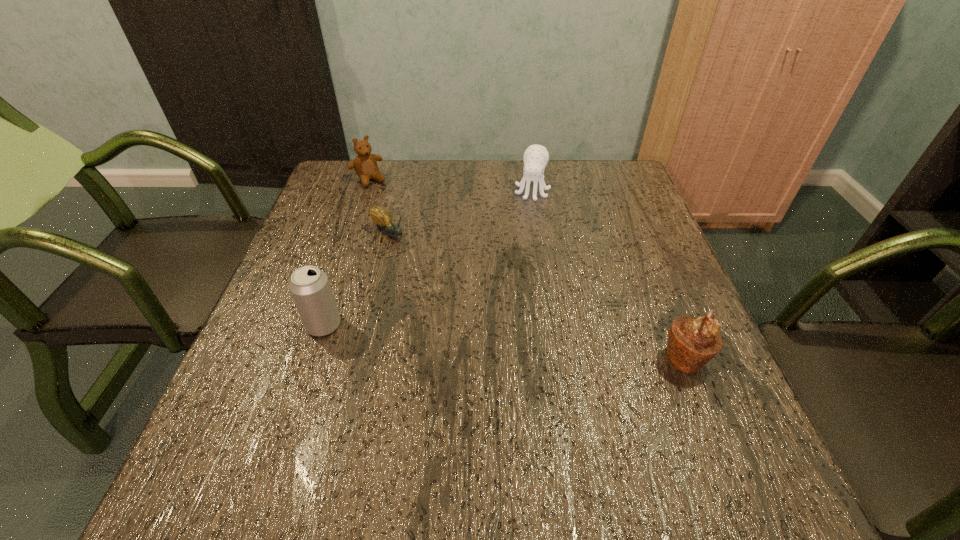
You are a GUI agent. You are given a task and a screenshot of the screen. Output one action in this format:
    pyautogui.click(x=<x>, y=<y>)
    Task: Click on the vacant space on the desktop that is between the second nearest object and the muffin and is positioned on the front-facing side of the shortest object
    
    Given the screenshot: What is the action you would take?
    pyautogui.click(x=512, y=342)

Image resolution: width=960 pixels, height=540 pixels. Identify the location of vacant space on the desktop that is between the fourth farthest object and the muffin and is positioned on the front-facing side of the octopus. (494, 341).

Where is `free space on the desktop that is between the beer can and the rightmost object and is positioned on the front-facing side of the teddy bear`? The width and height of the screenshot is (960, 540). free space on the desktop that is between the beer can and the rightmost object and is positioned on the front-facing side of the teddy bear is located at coordinates [x=503, y=341].